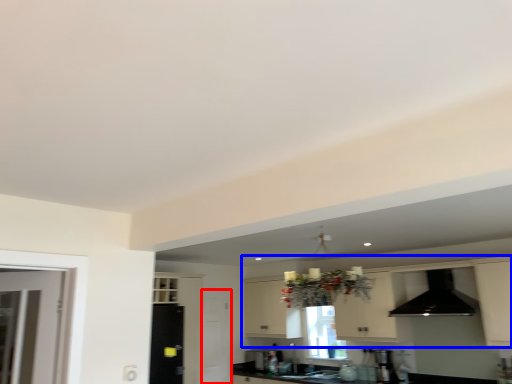
Question: Which of the following is the farthest to the observer, screen door (highlighted by a red box) or cabinetry (highlighted by a blue box)?

Choices:
 (A) screen door
 (B) cabinetry

Answer: (A)